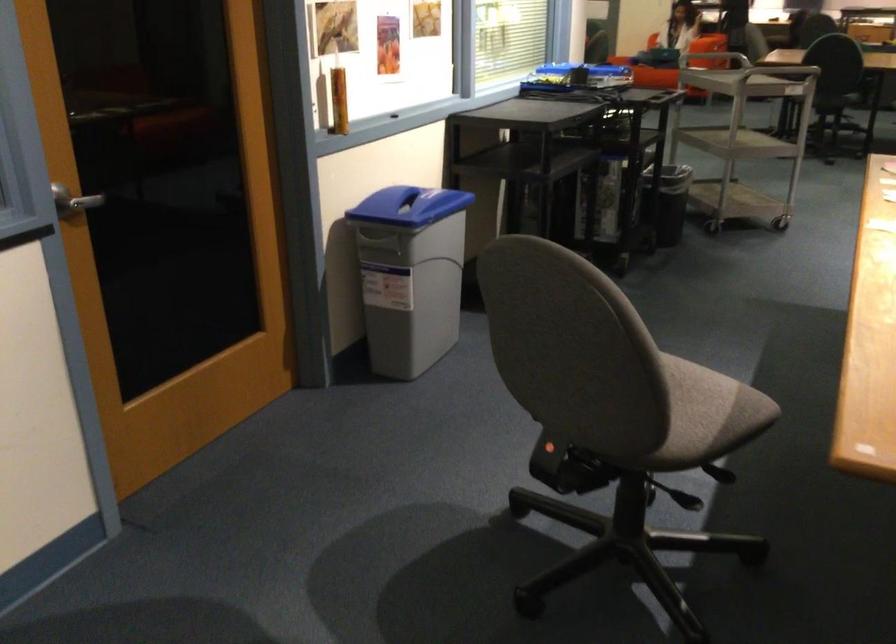
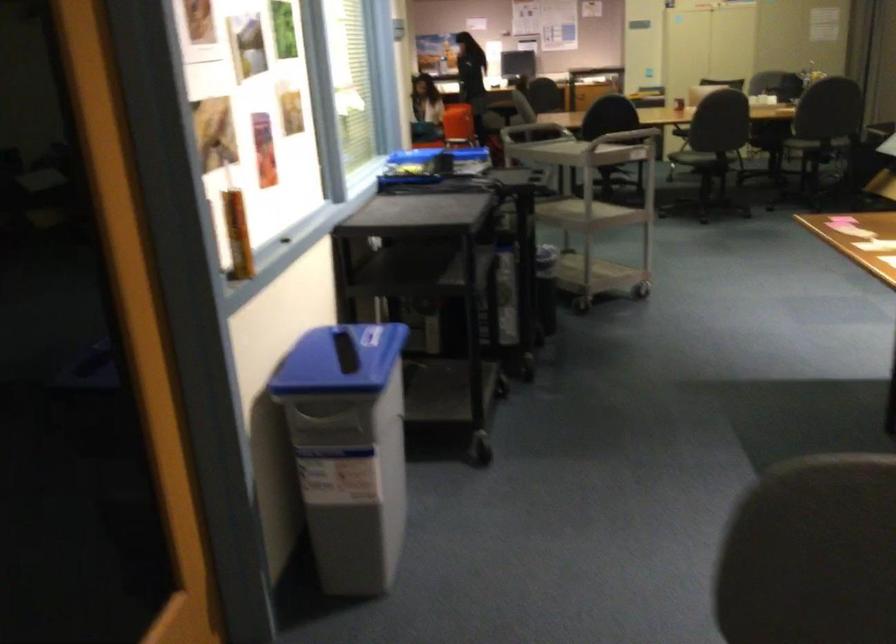
Question: The first image is from the beginning of the video and the second image is from the end. How did the camera likely rotate when shooting the video?

Choices:
 (A) Left
 (B) Right
 (C) Up
 (D) Down

Answer: (B)